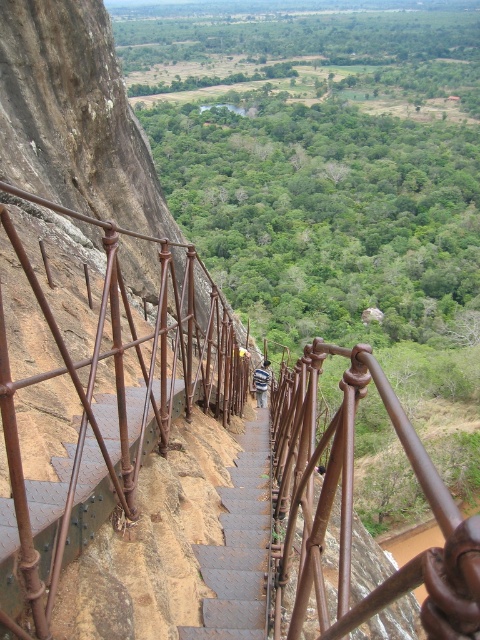
You are a hiker descending the steep staircase on the cliff. You notice two rusty metal railings along the way. Which one, the rusty metal railing at left or the rusty metal railing at center, is closer to you as you face the cliff?

The rusty metal railing at left is closer to you because the rusty metal railing at center is behind it.

You are a photographer holding a camera. You want to take a photo of the rusty metal railing at left while standing 3 meters away. Can you position yourself exactly at the required distance?

The distance between you and the rusty metal railing at left is 2.88 meters, so if you want to stand 3 meters away, you need to move back 0.12 meters to reach the desired distance.

You are a maintenance worker assigned to inspect the rusty metal railing at left and the brown textured stairs at center on the cliff. Your tool kit is at your waist, which is 0.5 meters long. When you are standing at the base of the stairs, can you reach the railing with your tool without moving your position?

The rusty metal railing at left is 4.66 meters away from the brown textured stairs at center. Since your tool kit is only 0.5 meters long, you cannot reach the railing from the base of the stairs without moving.